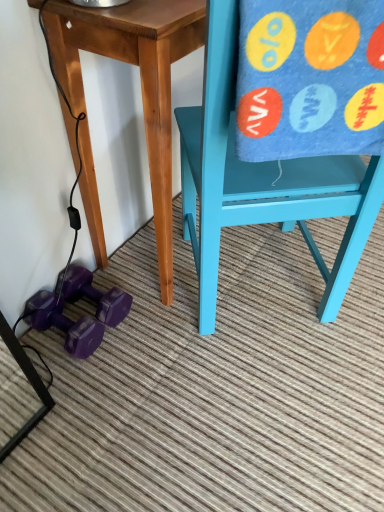
Question: Is matte blue chair at right turned away from wooden table at center?

Choices:
 (A) no
 (B) yes

Answer: (A)

Question: Does matte blue chair at right contain wooden table at center?

Choices:
 (A) no
 (B) yes

Answer: (B)

Question: Is matte blue chair at right to the right of wooden table at center from the viewer's perspective?

Choices:
 (A) no
 (B) yes

Answer: (B)

Question: Does matte blue chair at right have a greater height compared to wooden table at center?

Choices:
 (A) yes
 (B) no

Answer: (A)

Question: Does matte blue chair at right have a greater width compared to wooden table at center?

Choices:
 (A) yes
 (B) no

Answer: (A)

Question: Considering the positions of matte blue chair at right and wooden table at center in the image, is matte blue chair at right wider or thinner than wooden table at center?

Choices:
 (A) wide
 (B) thin

Answer: (A)

Question: From a real-world perspective, is matte blue chair at right above or below wooden table at center?

Choices:
 (A) below
 (B) above

Answer: (B)

Question: Is matte blue chair at right in front of or behind wooden table at center in the image?

Choices:
 (A) front
 (B) behind

Answer: (A)

Question: Is matte blue chair at right spatially inside wooden table at center, or outside of it?

Choices:
 (A) outside
 (B) inside

Answer: (A)

Question: Is point (374, 198) closer or farther from the camera than point (77, 336)?

Choices:
 (A) closer
 (B) farther

Answer: (A)

Question: In terms of width, does matte blue chair at right look wider or thinner when compared to purple rubber dumbbell at lower left, the second dumbbell in the top-to-bottom sequence?

Choices:
 (A) wide
 (B) thin

Answer: (A)

Question: Would you say matte blue chair at right is inside or outside purple rubber dumbbell at lower left, the second dumbbell in the top-to-bottom sequence?

Choices:
 (A) outside
 (B) inside

Answer: (A)

Question: Considering the positions of matte blue chair at right and purple rubber dumbbell at lower left, the 1th dumbbell from the bottom, in the image, is matte blue chair at right taller or shorter than purple rubber dumbbell at lower left, the 1th dumbbell from the bottom,?

Choices:
 (A) short
 (B) tall

Answer: (B)

Question: Does point (279, 57) appear closer or farther from the camera than point (231, 6)?

Choices:
 (A) closer
 (B) farther

Answer: (B)

Question: From the image's perspective, is blue felt beach towel at right above or below matte blue chair at right?

Choices:
 (A) below
 (B) above

Answer: (B)